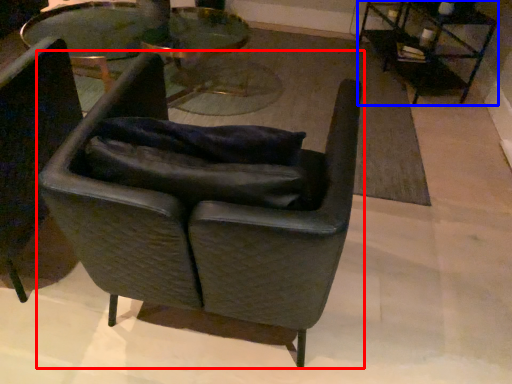
Question: Which object appears farthest to the camera in this image, chair (highlighted by a red box) or table (highlighted by a blue box)?

Choices:
 (A) chair
 (B) table

Answer: (B)